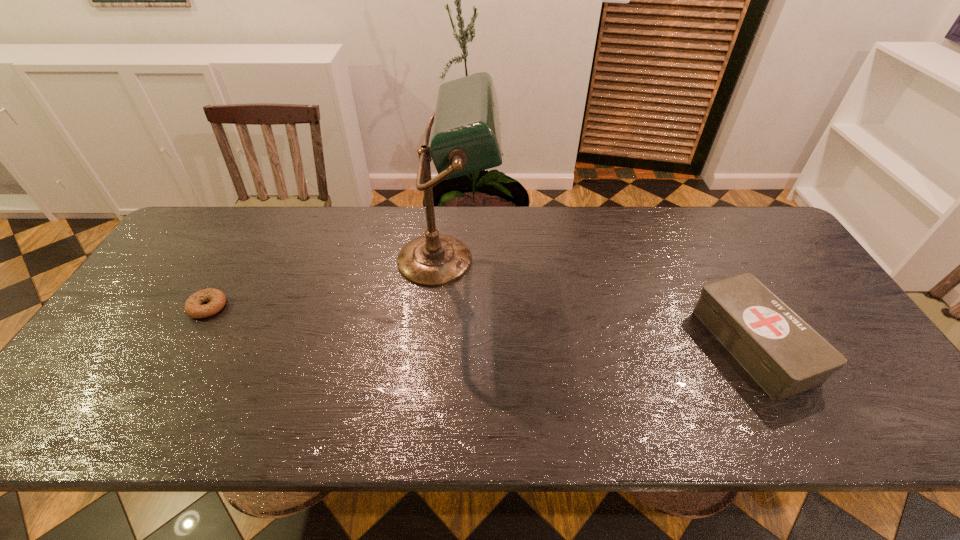
At what (x,y) coordinates should I click in order to perform the action: click on vacant space that satisfies the following two spatial constraints: 1. above the green lampshade of the table lamp; 2. on the back side of the second shortest object. Please return your answer as a coordinate pair (x, y). The width and height of the screenshot is (960, 540). Looking at the image, I should click on (441, 345).

Locate an element on the screen. This screenshot has width=960, height=540. free space that satisfies the following two spatial constraints: 1. above the green lampshade of the second object from left to right; 2. on the left side of the first-aid kit is located at coordinates (441, 345).

Identify the location of free space that satisfies the following two spatial constraints: 1. on the front side of the shortest object; 2. on the right side of the rightmost object. This screenshot has height=540, width=960. coord(185,345).

Find the location of a particular element. vacant space that satisfies the following two spatial constraints: 1. above the green lampshade of the first-aid kit; 2. on the left side of the tallest object is located at coordinates pyautogui.click(x=441, y=345).

This screenshot has width=960, height=540. Identify the location of free location that satisfies the following two spatial constraints: 1. on the back side of the second tallest object; 2. above the green lampshade of the table lamp. (708, 260).

This screenshot has width=960, height=540. I want to click on vacant area that satisfies the following two spatial constraints: 1. on the back side of the rightmost object; 2. above the green lampshade of the tallest object, so coord(708,260).